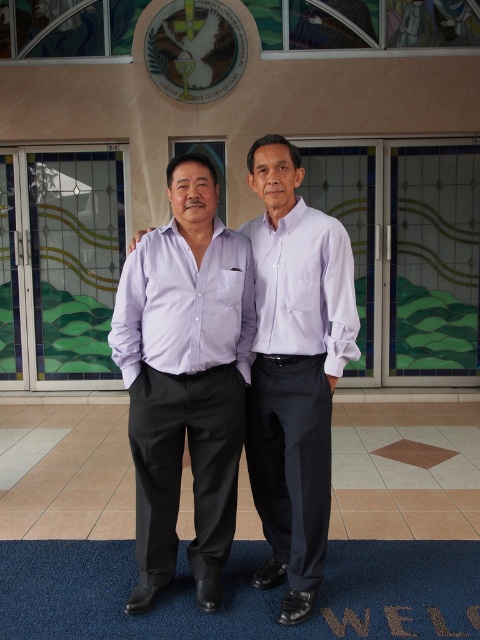
You are a photographer setting up for an event. You need to position a 2x3 foot backdrop behind the lavender cotton shirt at center. Can the blue carpet at lower center accommodate this backdrop without overlapping the shirt?

The blue carpet at lower center is bigger than the lavender cotton shirt at center, so it can accommodate the 2x3 foot backdrop behind the lavender cotton shirt at center without overlapping.

You are a photographer setting up for a formal event. You need to ensure that the two shirts, the matte purple shirt at center and the lavender cotton shirt at center, are spaced exactly 12 inches apart for the photo. Based on the current setup, will you need to adjust their positions?

The matte purple shirt at center is currently 12.19 inches from the lavender cotton shirt at center. Since 12.19 inches is slightly more than 12 inches, you should move them closer by approximately 0.19 inches to meet the required spacing.

You are a photographer trying to capture both the matte purple shirt at center and the lavender cotton shirt at center in a single frame. Which shirt should you focus on first to ensure both are in the frame?

The matte purple shirt at center is taller than the lavender cotton shirt at center, so you should focus on the matte purple shirt at center first to ensure both are in the frame.